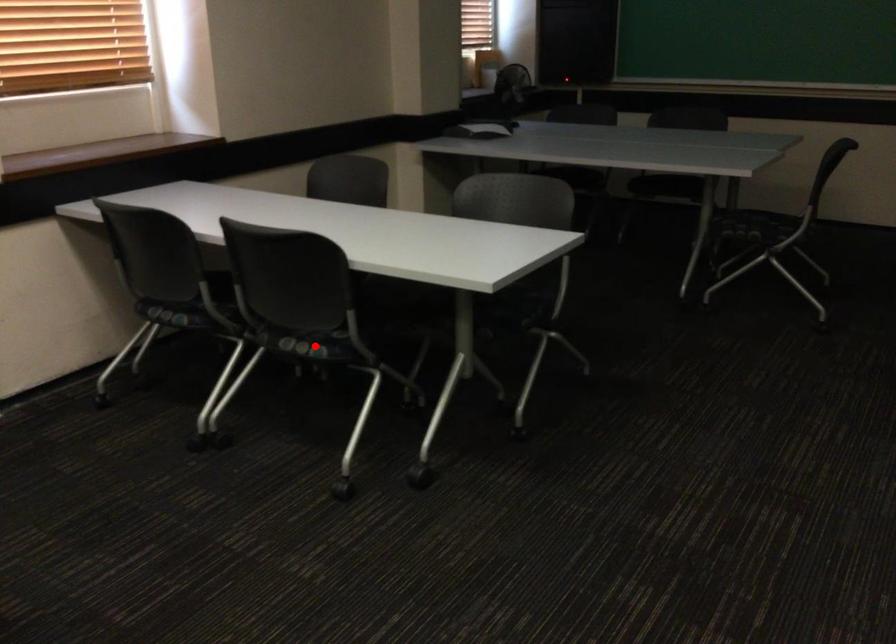
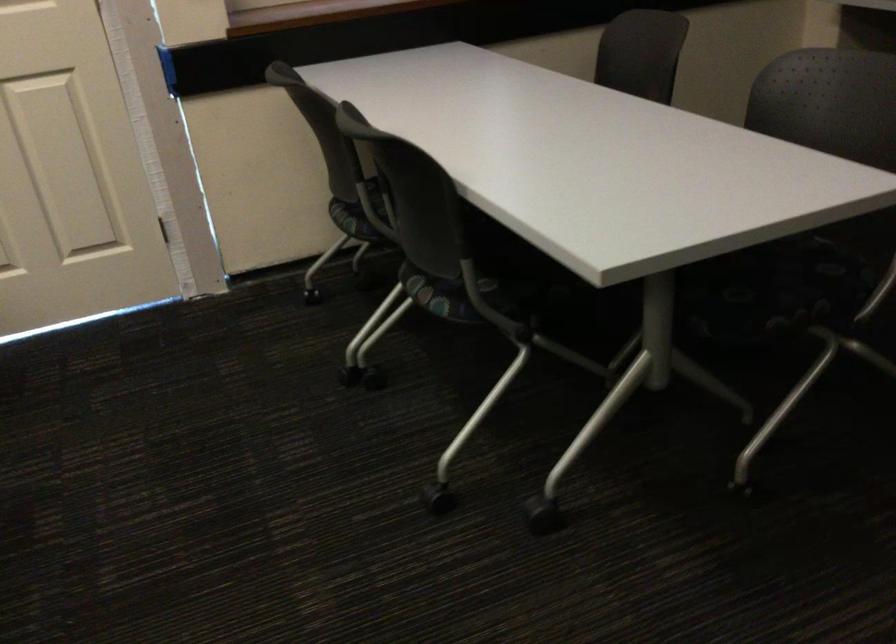
Find the pixel in the second image that matches the highlighted location in the first image.

(442, 295)